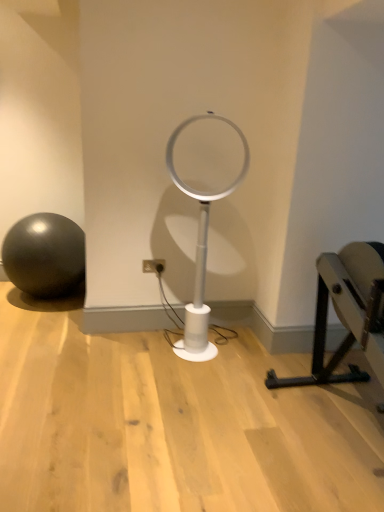
This screenshot has height=512, width=384. In order to click on unoccupied area in front of white plastic table lamp at center in this screenshot , I will do `click(203, 375)`.